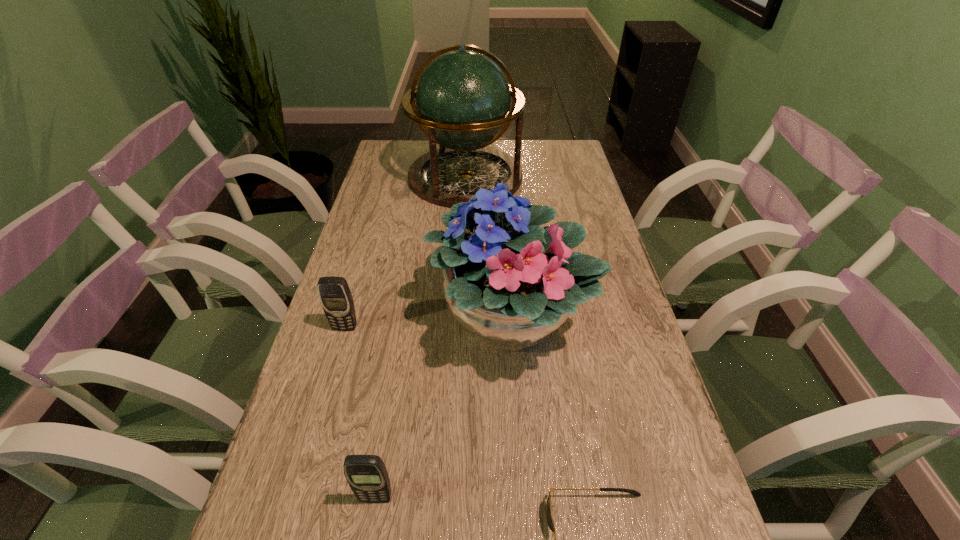
The image size is (960, 540). I want to click on the tallest object, so click(x=463, y=99).

This screenshot has height=540, width=960. What are the coordinates of `globe` in the screenshot? It's located at (463, 99).

In order to click on the second tallest object in this screenshot , I will do `click(510, 284)`.

The height and width of the screenshot is (540, 960). Identify the location of the left cellular telephone. (335, 296).

You are a GUI agent. You are given a task and a screenshot of the screen. Output one action in this format:
    pyautogui.click(x=<x>, y=<y>)
    Task: Click on the farther cellular telephone
    
    Given the screenshot: What is the action you would take?
    pyautogui.click(x=335, y=296)

Image resolution: width=960 pixels, height=540 pixels. I want to click on the right cellular telephone, so click(x=367, y=476).

The height and width of the screenshot is (540, 960). I want to click on free space located 0.190m on the front-facing side of the farthest object, so click(462, 248).

You are a GUI agent. You are given a task and a screenshot of the screen. Output one action in this format:
    pyautogui.click(x=<x>, y=<y>)
    Task: Click on the vacant point located on the back of the bouquet
    
    Given the screenshot: What is the action you would take?
    pyautogui.click(x=505, y=242)

Where is `free space located on the front face of the farther cellular telephone`? free space located on the front face of the farther cellular telephone is located at coordinates (298, 489).

The width and height of the screenshot is (960, 540). I want to click on object at the far edge, so click(x=463, y=99).